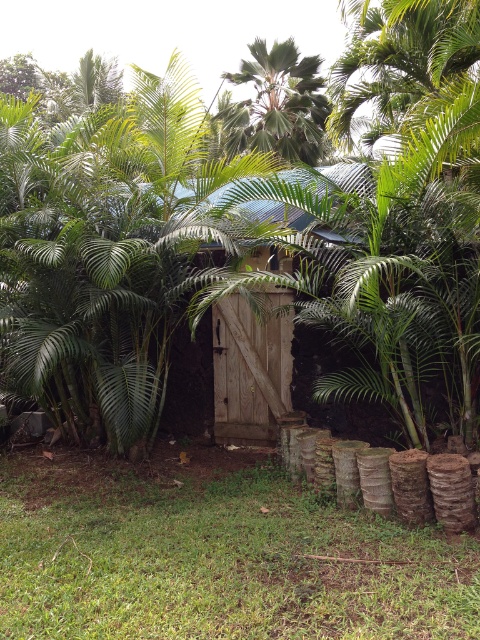
Who is shorter, wooden door at center or green leafy palm tree at upper center?

Standing shorter between the two is wooden door at center.

The image size is (480, 640). Find the location of `wooden door at center`. wooden door at center is located at coordinates (252, 365).

Identify the location of wooden door at center. The height and width of the screenshot is (640, 480). (252, 365).

Is green leafy tree at center thinner than wooden door at center?

No, green leafy tree at center is not thinner than wooden door at center.

Can you confirm if green leafy tree at center is positioned below wooden door at center?

Incorrect, green leafy tree at center is not positioned below wooden door at center.

Identify the location of green leafy tree at center. Image resolution: width=480 pixels, height=640 pixels. (267, 228).

Can you confirm if green leafy tree at center is bigger than green leafy palm tree at upper center?

Indeed, green leafy tree at center has a larger size compared to green leafy palm tree at upper center.

Can you confirm if green leafy tree at center is positioned above green leafy palm tree at upper center?

Actually, green leafy tree at center is below green leafy palm tree at upper center.

Between point (456, 300) and point (240, 118), which one is positioned in front?

Point (456, 300)

At what (x,y) coordinates should I click in order to perform the action: click on green leafy tree at center. Please return your answer as a coordinate pair (x, y). The height and width of the screenshot is (640, 480). Looking at the image, I should click on (267, 228).